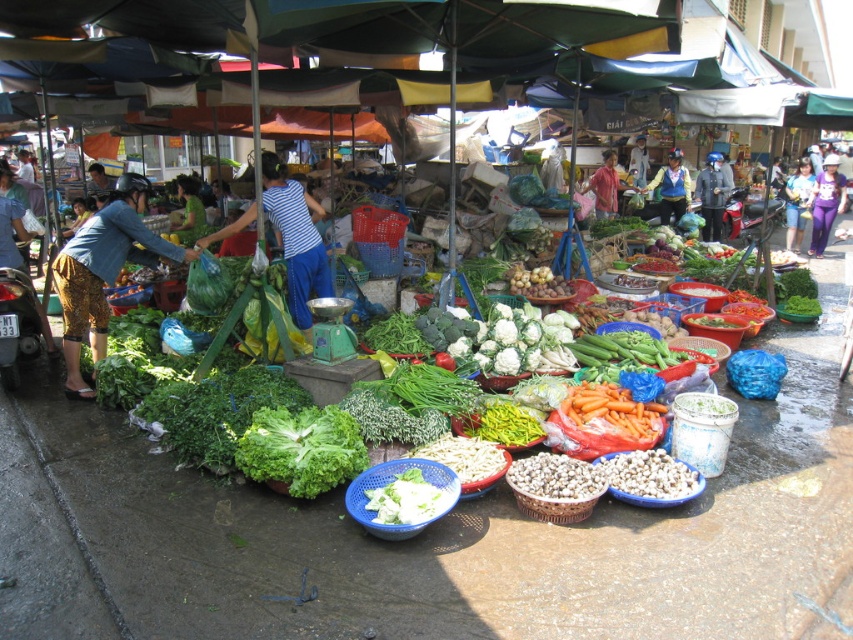
Is red shirt at center to the left of light blue striped shirt at center from the viewer's perspective?

Indeed, red shirt at center is positioned on the left side of light blue striped shirt at center.

Which of these two, red shirt at center or light blue striped shirt at center, stands shorter?

red shirt at center

This screenshot has width=853, height=640. Describe the element at coordinates (605, 186) in the screenshot. I see `red shirt at center` at that location.

Identify the location of red shirt at center. (605, 186).

Is blue printed skirt at left smaller than red shirt at center?

Actually, blue printed skirt at left might be larger than red shirt at center.

Does blue printed skirt at left have a greater height compared to red shirt at center?

Indeed, blue printed skirt at left has a greater height compared to red shirt at center.

In order to click on blue printed skirt at left in this screenshot , I will do pyautogui.click(x=102, y=276).

Where is `blue printed skirt at left`? This screenshot has height=640, width=853. blue printed skirt at left is located at coordinates (102, 276).

Can you confirm if yellow-green fabric bag at center is positioned to the right of light blue striped shirt at center?

In fact, yellow-green fabric bag at center is to the left of light blue striped shirt at center.

Is yellow-green fabric bag at center below light blue striped shirt at center?

Yes.

Is point (671, 166) positioned behind point (646, 168)?

No, (671, 166) is closer to viewer.

Where is `yellow-green fabric bag at center`? The width and height of the screenshot is (853, 640). yellow-green fabric bag at center is located at coordinates (671, 188).